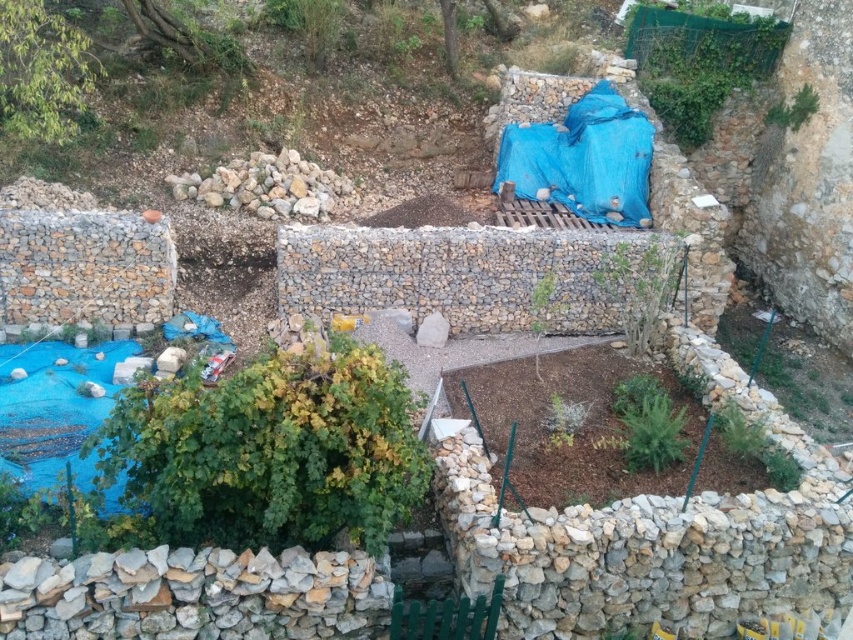
You are a gardener who needs to place a 30 feet long hose between the natural stone wall at lower left and the natural stone at center. Can you fit the hose between them without bending it?

The distance between the natural stone wall at lower left and the natural stone at center is 29.79 feet, which is slightly less than the 30 feet length of the hose. Therefore, the hose cannot be placed straight between them without bending.

You are standing in the garden and want to place a small statue exactly halfway between point (350, 563) and point (268, 218). However, you can only place it on the side closer to the camera. Which point should you use as the reference for placing the statue?

Point (350, 563) is closer to the camera than point (268, 218), so you should use point (350, 563) as the reference for placing the statue.